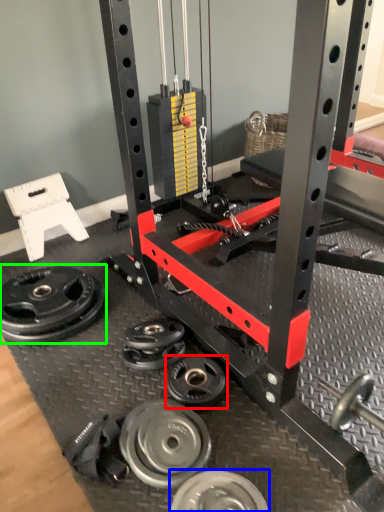
Question: Estimate the real-world distances between objects in this image. Which object is closer to wheel (highlighted by a red box), wheel (highlighted by a blue box) or wheel (highlighted by a green box)?

Choices:
 (A) wheel
 (B) wheel

Answer: (A)